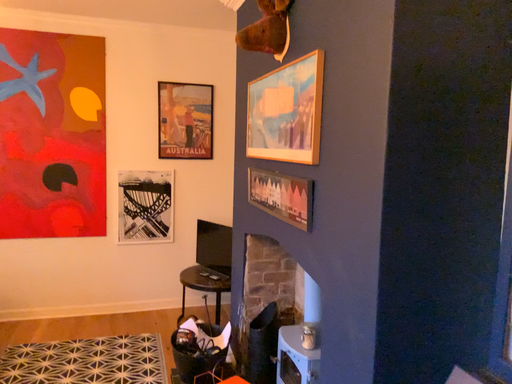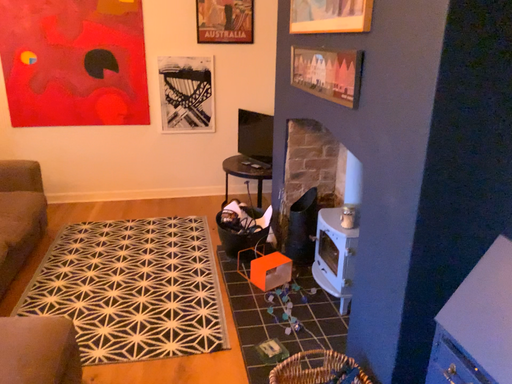
Question: Which way did the camera rotate in the video?

Choices:
 (A) rotated upward
 (B) rotated downward

Answer: (B)